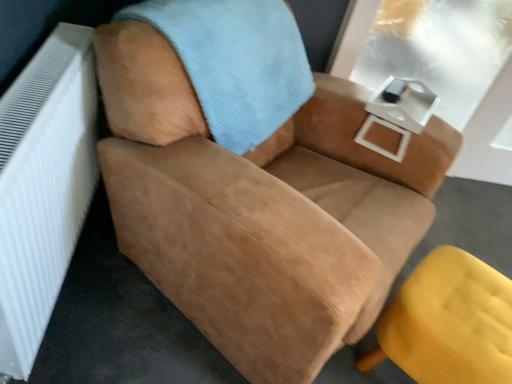
Find the location of a particular element. empty space that is ontop of matte yellow ottoman at lower right, which is the 2th chair from top to bottom is located at coordinates (468, 306).